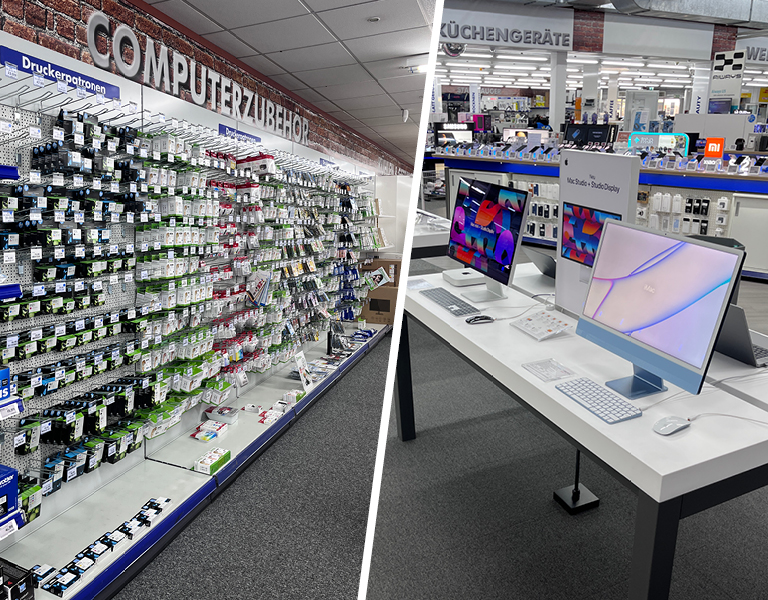
I want to click on table, so click(683, 462).